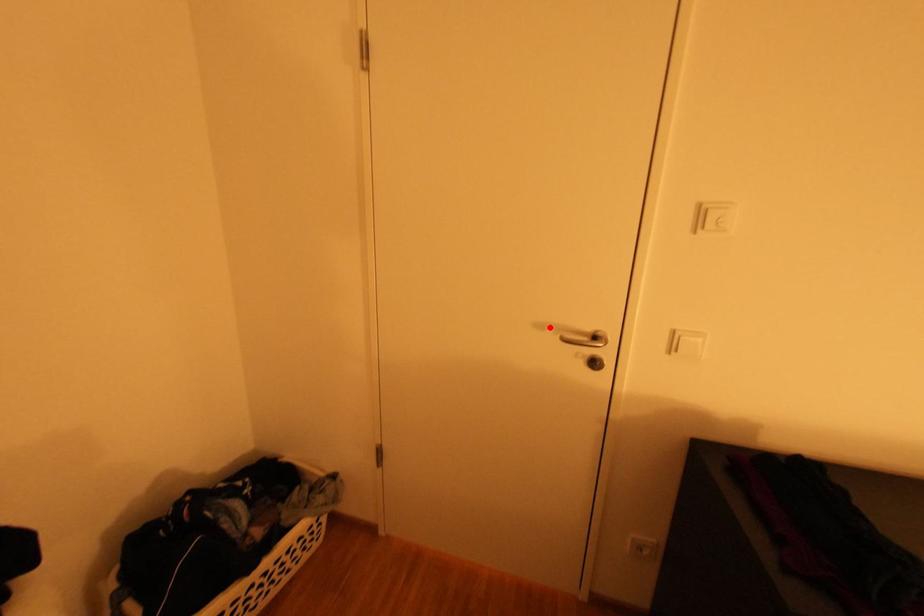
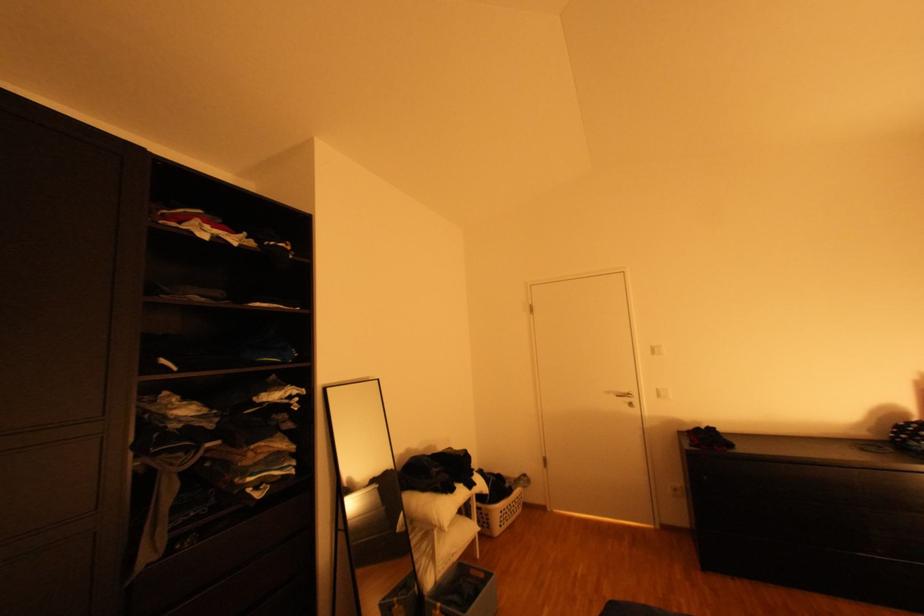
Question: I am providing you with two images of the same scene from different viewpoints. A red point is marked on the first image. At the location where the point appears in image 1, is it still visible in image 2?

Choices:
 (A) Yes
 (B) No

Answer: (A)